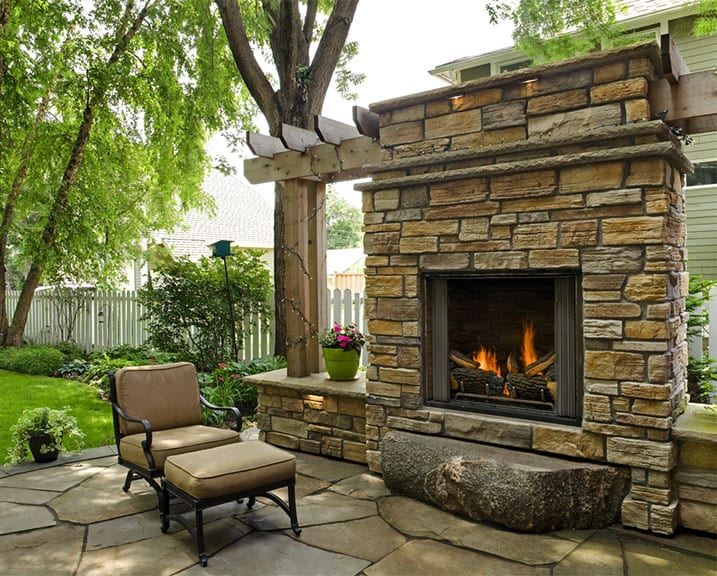
At what (x,y) coordinates should I click in order to perform the action: click on fireplace brick. Please return your answer as a coordinate pair (x, y). This screenshot has height=576, width=717. Looking at the image, I should click on (523, 213).